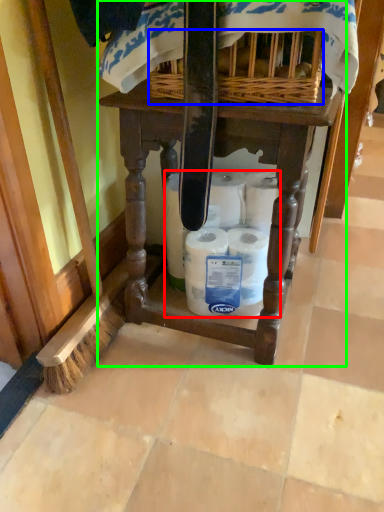
Question: Which object is the farthest from toilet paper (highlighted by a red box)? Choose among these: basket (highlighted by a blue box) or furniture (highlighted by a green box).

Choices:
 (A) basket
 (B) furniture

Answer: (A)